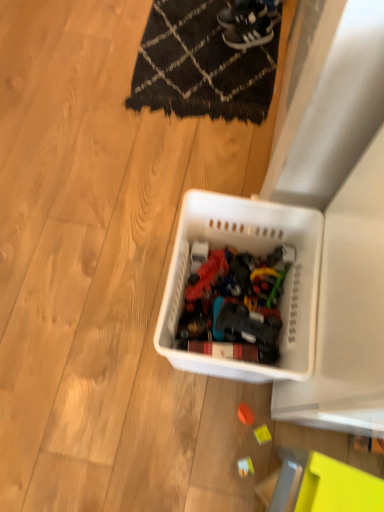
I want to click on vacant point to the right of orange matte ball at center, acting as the 3th toy starting from the bottom, so pyautogui.click(x=298, y=429).